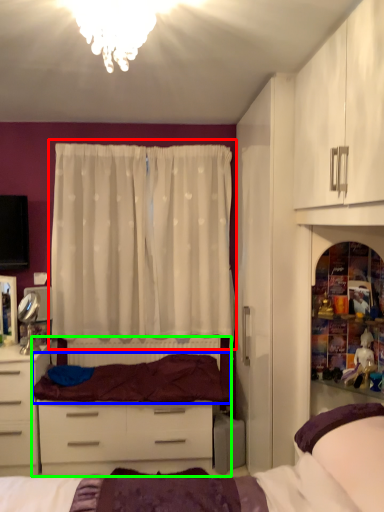
Question: Which object is positioned closest to curtain (highlighted by a red box)? Select from bedding (highlighted by a blue box) and entertainment center (highlighted by a green box).

Choices:
 (A) bedding
 (B) entertainment center

Answer: (A)